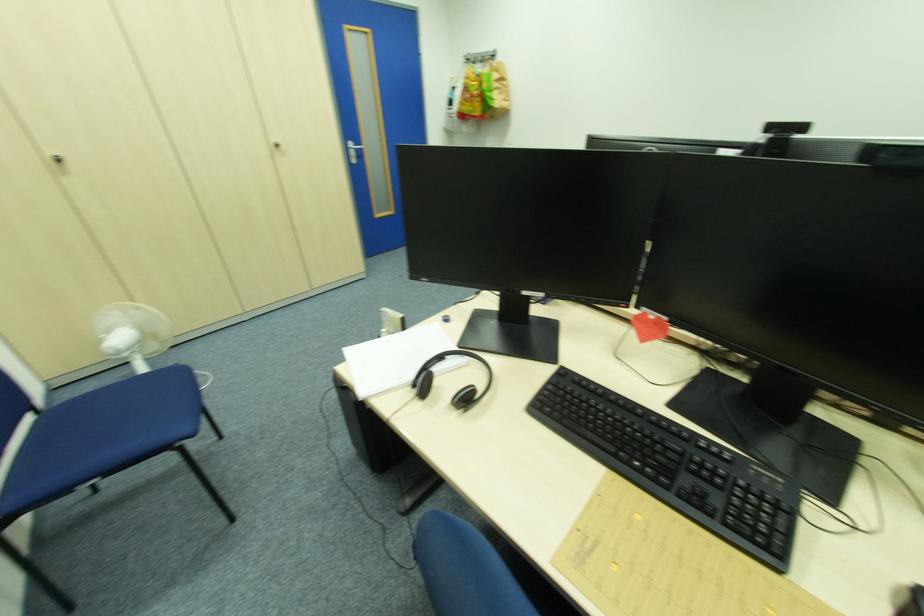
Where would you sitting on the blue chair sitting surface? Please return your answer as a coordinate pair (x, y).

(101, 436)